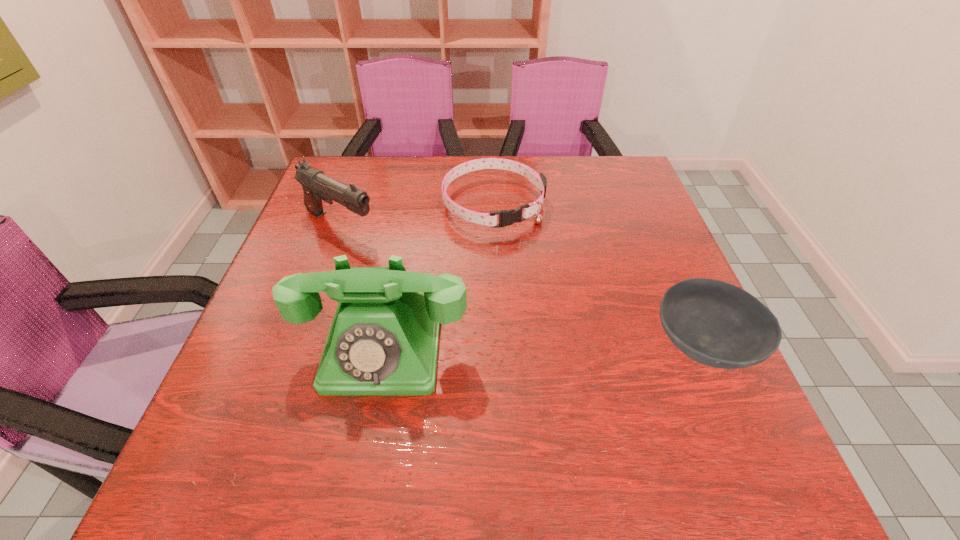
Where is `telephone`? The height and width of the screenshot is (540, 960). telephone is located at coordinates (383, 340).

You are a GUI agent. You are given a task and a screenshot of the screen. Output one action in this format:
    pyautogui.click(x=<x>, y=<y>)
    Task: Click on the rightmost object
    Image resolution: width=960 pixels, height=540 pixels.
    Given the screenshot: What is the action you would take?
    pyautogui.click(x=717, y=324)

I want to click on the third tallest object, so click(717, 324).

Locate an element on the screen. The height and width of the screenshot is (540, 960). dog collar is located at coordinates (506, 217).

The height and width of the screenshot is (540, 960). In order to click on gun in this screenshot , I will do `click(317, 186)`.

Where is `vacant space situated 0.060m on the dial of the telephone`? The width and height of the screenshot is (960, 540). vacant space situated 0.060m on the dial of the telephone is located at coordinates (368, 429).

In order to click on vacant space situated on the left of the second shortest object in this screenshot , I will do `click(522, 346)`.

The height and width of the screenshot is (540, 960). What are the coordinates of `vacant space located 0.280m with the buckle on the shortest object` in the screenshot? It's located at (569, 315).

At what (x,y) coordinates should I click in order to perform the action: click on free space located with the buckle on the shortest object. Please return your answer as a coordinate pair (x, y). This screenshot has width=960, height=540. Looking at the image, I should click on (538, 268).

I want to click on vacant point located with the buckle on the shortest object, so click(543, 277).